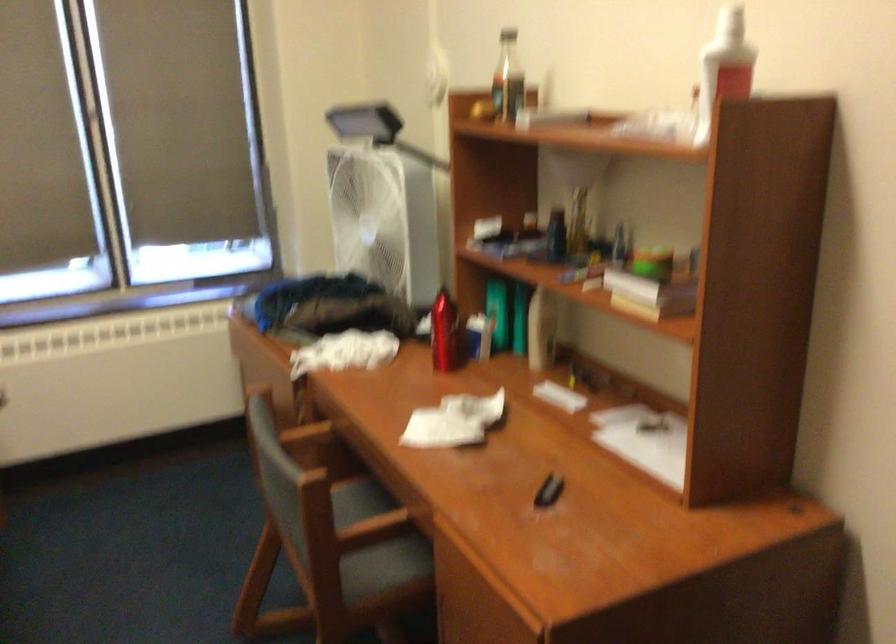
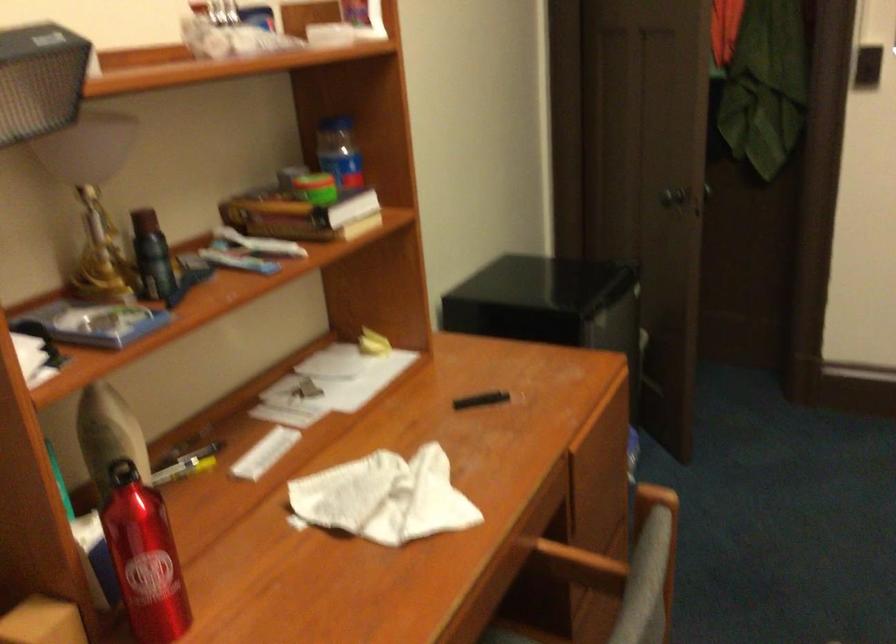
Where in the second image is the point corresponding to the point at 770,257 from the first image?

(339, 152)